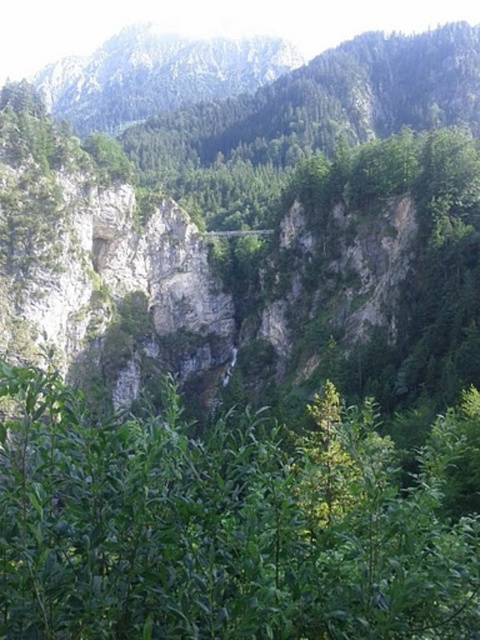
You are standing at the edge of the valley and want to take a photo of the green leafy tree at center. If your camera has a maximum zoom range of 100 feet, will you be able to capture the tree clearly without moving closer?

The distance between the green leafy tree at center and the viewer is 92.05 feet. Since the camera can zoom up to 100 feet, it is within range. Therefore, you can capture the tree clearly without moving closer.

You are an environmental scientist assessing the biodiversity of this mountain area. You notice the green leafy tree at center and the rocky mountain at upper center. Which of these two has a smaller width in the image?

The green leafy tree at center has a smaller width compared to the rocky mountain at upper center.

You are a hiker planning to take a photo of the green leafy tree at center and the rocky mountain at upper center. Which object should you focus on first if you want both to be in clear focus?

The green leafy tree at center is positioned under the rocky mountain at upper center, so you should focus on the green leafy tree at center first to ensure both are in focus.